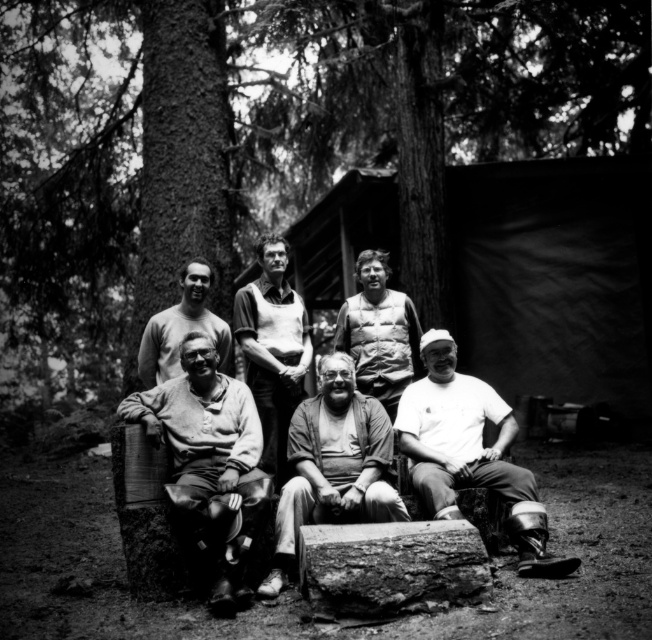
You are planning to take a photo of the brown rough tree trunk at left and the white matte shirt at lower right. Which object should you focus on first if you want to capture both in a single frame without moving the camera?

You should focus on the brown rough tree trunk at left first because it is larger than the white matte shirt at lower right, allowing it to be more prominent in the frame.

You are a photographer trying to capture a group photo of the matte gray shirt at center and the light gray sweater at center. To ensure both subjects are in focus, you need to know which one is wider. Can you determine which one is wider?

The matte gray shirt at center might be wider than light gray sweater at center, so it is possible that the matte gray shirt at center is wider. However, the description states it might be wider, so there is some uncertainty.